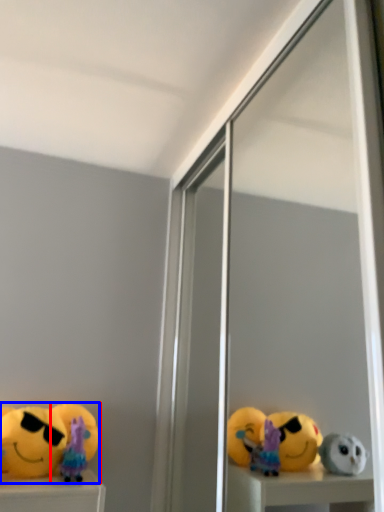
Question: Which point is further to the camera, toy (highlighted by a red box) or toy (highlighted by a blue box)?

Choices:
 (A) toy
 (B) toy

Answer: (A)